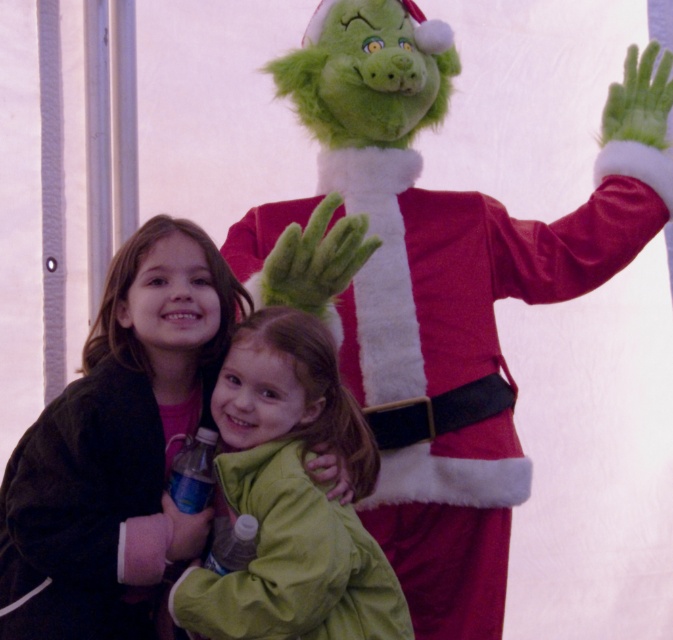
You are a photographer adjusting your camera to focus on two specific points in the image. The first point is at coordinates point (476, 548) and the second is at point (262, 618). Which point should you focus on first to ensure the closest object is sharp?

Point (476, 548) should be focused on first because it is closer to the camera than point (262, 618).

You are a photographer setting up a photo shoot with two girls wearing the matte green jacket at center and green fuzzy coat at center. You need to arrange them so that the shorter one is in front for better visibility. Which girl should be placed in front?

The green fuzzy coat at center is shorter than the matte green jacket at center, so the girl wearing the green fuzzy coat at center should be placed in front to ensure visibility.

You are a photographer trying to capture a clear shot of both the fuzzy red santa at center and the green fuzzy coat at center. Since you can only focus on one object at a time, which one should you choose to ensure the other is still somewhat in focus?

You should focus on the fuzzy red santa at center because it is closer to you than the green fuzzy coat at center. By focusing on the closer object, the background object will still be somewhat in focus.